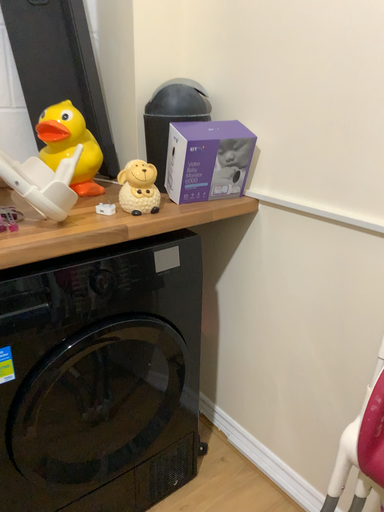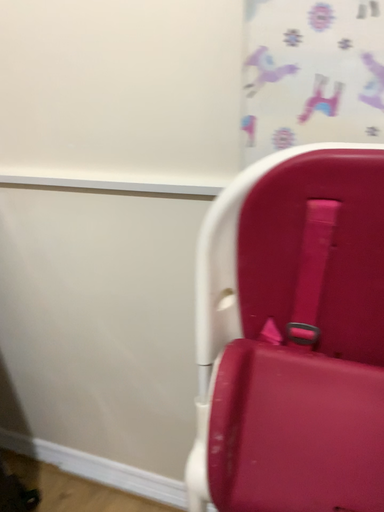
Question: How did the camera likely rotate when shooting the video?

Choices:
 (A) rotated right
 (B) rotated left

Answer: (A)